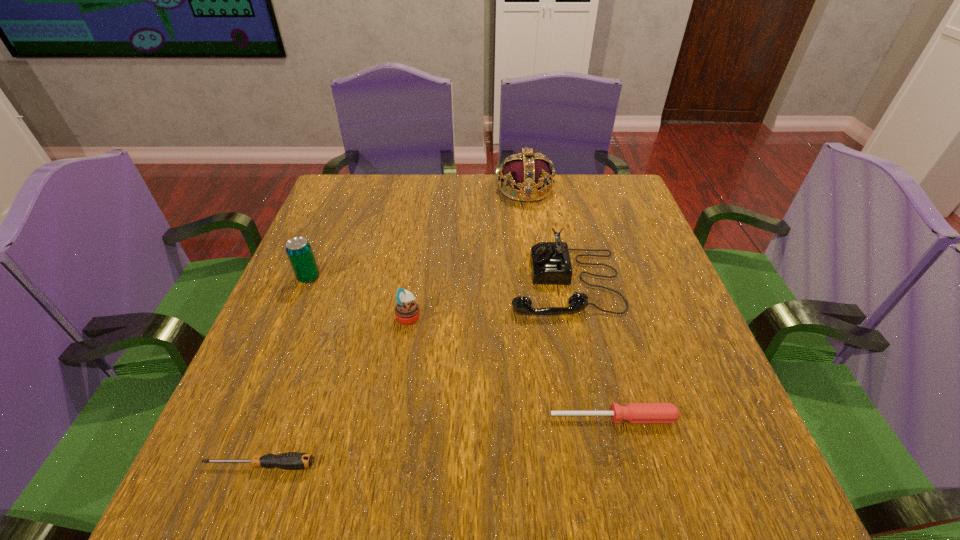
I want to click on beer can at the left edge, so click(298, 249).

The image size is (960, 540). Identify the location of screwdriver at the left edge. (291, 460).

At what (x,y) coordinates should I click in order to perform the action: click on telephone located in the right edge section of the desktop. Please return your answer as a coordinate pair (x, y). This screenshot has height=540, width=960. Looking at the image, I should click on (550, 261).

The image size is (960, 540). I want to click on screwdriver that is positioned at the right edge, so click(x=633, y=412).

At what (x,y) coordinates should I click in order to perform the action: click on object that is positioned at the near left corner. Please return your answer as a coordinate pair (x, y). Looking at the image, I should click on (291, 460).

In the image, there is a desktop. At what (x,y) coordinates should I click in order to perform the action: click on vacant region at the far edge. Please return your answer as a coordinate pair (x, y). Looking at the image, I should click on (554, 189).

Where is `free space at the left edge`? Image resolution: width=960 pixels, height=540 pixels. free space at the left edge is located at coordinates (282, 387).

Locate an element on the screen. blank space at the right edge of the desktop is located at coordinates (643, 374).

Find the location of `free space at the far left corner`. free space at the far left corner is located at coordinates (338, 220).

Where is `free area in between the second nearest object and the telephone`? This screenshot has height=540, width=960. free area in between the second nearest object and the telephone is located at coordinates (588, 350).